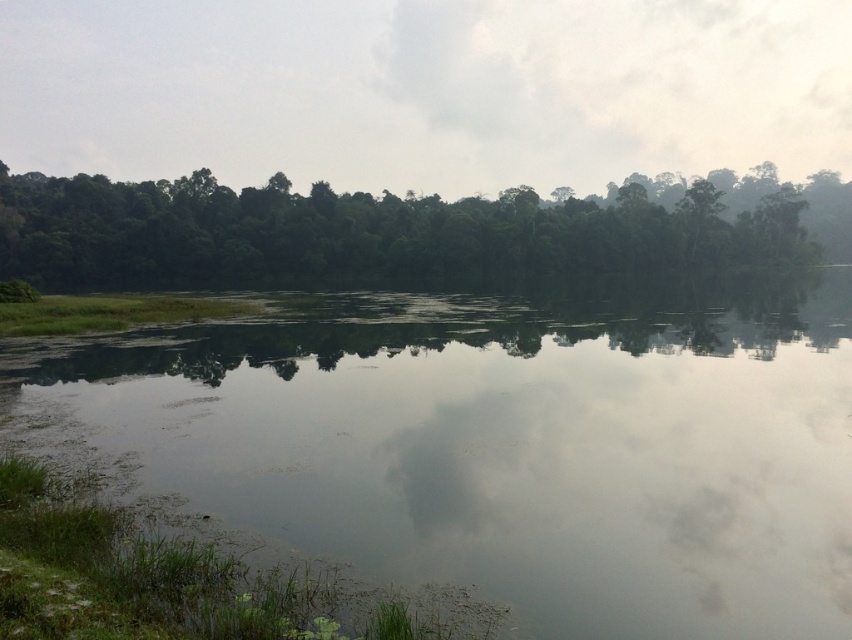
Is green grassy river at center wider than green leafy trees at upper center?

No.

Where is `green grassy river at center`? This screenshot has width=852, height=640. green grassy river at center is located at coordinates (511, 444).